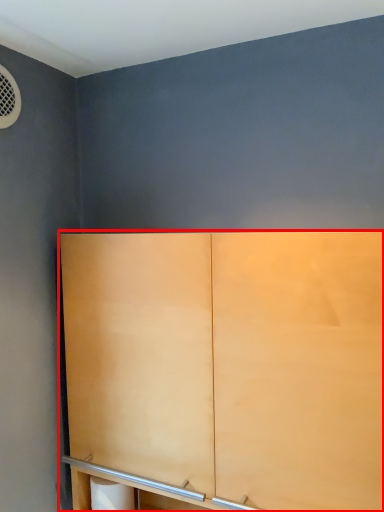
Question: Where is cupboard (annotated by the red box) located in relation to toilet paper in the image?

Choices:
 (A) left
 (B) right

Answer: (B)